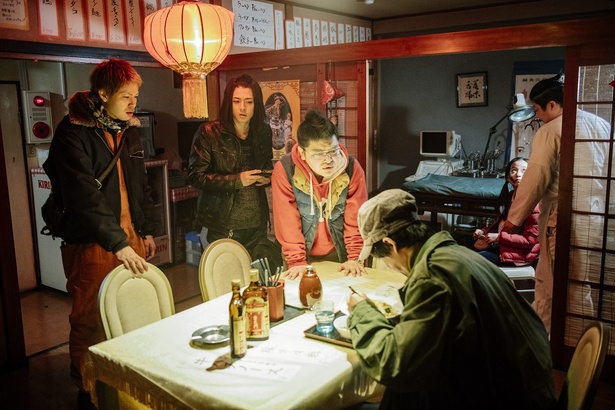
This screenshot has height=410, width=615. Identify the location of lantern. (195, 34).